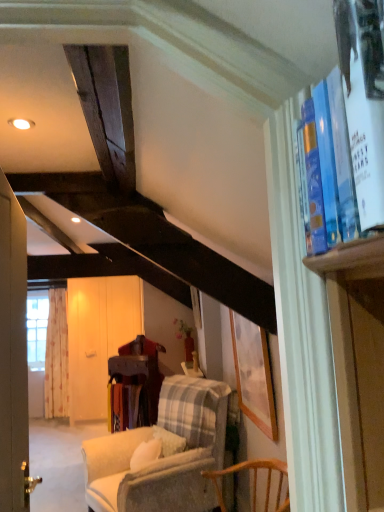
I want to click on plaid fabric chair at center, so click(x=163, y=457).

This screenshot has width=384, height=512. What do you see at coordinates (57, 356) in the screenshot? I see `light beige fabric curtain at left` at bounding box center [57, 356].

Where is `blue hardcover book at upper right`? blue hardcover book at upper right is located at coordinates (363, 101).

You are a GUI agent. You are given a task and a screenshot of the screen. Output one action in this format:
    pyautogui.click(x=<x>, y=<y>)
    Task: Click on the chair on the left of blue hardcover book at upper right
    This screenshot has height=512, width=384.
    Given the screenshot: What is the action you would take?
    pyautogui.click(x=163, y=457)

Based on the photo, which is farther, (132, 504) or (349, 125)?

The point (132, 504) is farther.

What's the angular difference between plaid fabric chair at center and blue hardcover book at upper right's facing directions?

They differ by 25.8 degrees in their facing directions.

Identify the location of screen door behind the blue hardcover book at upper right. The height and width of the screenshot is (512, 384). (98, 337).

From a real-world perspective, which object rests below the other?

white wood screen door at center, from a real-world perspective.

In the scene shown: Between white wood screen door at center and blue hardcover book at upper right, which one has smaller width?

With smaller width is blue hardcover book at upper right.

Is white wood screen door at center to the left or to the right of blue hardcover book at upper right in the image?

Clearly, white wood screen door at center is on the left of blue hardcover book at upper right in the image.

Measure the distance between light beige fabric curtain at left and blue hardcover book at upper right.

light beige fabric curtain at left is 5.40 meters from blue hardcover book at upper right.

Are light beige fabric curtain at left and blue hardcover book at upper right far apart?

light beige fabric curtain at left is positioned a significant distance from blue hardcover book at upper right.

From the picture: Would you say light beige fabric curtain at left contains blue hardcover book at upper right?

No, blue hardcover book at upper right is not surrounded by light beige fabric curtain at left.

From the image's perspective, is light beige fabric curtain at left above blue hardcover book at upper right?

No, from the image's perspective, light beige fabric curtain at left is not above blue hardcover book at upper right.

Which object is wider, white wood screen door at center or matte wooden picture frame at center?

Wider between the two is white wood screen door at center.

Between white wood screen door at center and matte wooden picture frame at center, which one appears on the left side from the viewer's perspective?

white wood screen door at center.

From a real-world perspective, which object stands above the other?

From a 3D spatial view, matte wooden picture frame at center is above.

From the image's perspective, is white wood screen door at center on top of matte wooden picture frame at center?

No, from the image's perspective, white wood screen door at center is not on top of matte wooden picture frame at center.

At what (x,y) coordinates should I click in order to perform the action: click on curtain below the matte wooden picture frame at center (from the image's perspective). Please return your answer as a coordinate pair (x, y). Image resolution: width=384 pixels, height=512 pixels. Looking at the image, I should click on (57, 356).

From the image's perspective, relative to matte wooden picture frame at center, is light beige fabric curtain at left above or below?

Clearly, from the image's perspective, light beige fabric curtain at left is below matte wooden picture frame at center.

Measure the distance from light beige fabric curtain at left to matte wooden picture frame at center.

light beige fabric curtain at left is 10.78 feet from matte wooden picture frame at center.

Between light beige fabric curtain at left and matte wooden picture frame at center, which one appears on the right side from the viewer's perspective?

Positioned to the right is matte wooden picture frame at center.

Could you tell me if blue hardcover book at upper right is turned towards matte wooden picture frame at center?

No, blue hardcover book at upper right is not turned towards matte wooden picture frame at center.

From their relative heights in the image, would you say blue hardcover book at upper right is taller or shorter than matte wooden picture frame at center?

Clearly, blue hardcover book at upper right is shorter compared to matte wooden picture frame at center.

Considering the relative sizes of blue hardcover book at upper right and matte wooden picture frame at center in the image provided, is blue hardcover book at upper right thinner than matte wooden picture frame at center?

No, blue hardcover book at upper right is not thinner than matte wooden picture frame at center.

Does blue hardcover book at upper right contain matte wooden picture frame at center?

No, blue hardcover book at upper right does not contain matte wooden picture frame at center.

Who is more distant, white wood screen door at center or light beige fabric curtain at left?

light beige fabric curtain at left is more distant.

Is white wood screen door at center facing towards light beige fabric curtain at left?

No.

Is white wood screen door at center bigger than light beige fabric curtain at left?

Indeed, white wood screen door at center has a larger size compared to light beige fabric curtain at left.

Are white wood screen door at center and light beige fabric curtain at left far apart?

Actually, white wood screen door at center and light beige fabric curtain at left are a little close together.

Locate an element on the screen. The width and height of the screenshot is (384, 512). chair below the blue hardcover book at upper right (from the image's perspective) is located at coordinates (163, 457).

This screenshot has height=512, width=384. I want to click on book above the white wood screen door at center (from a real-world perspective), so click(363, 101).

When comparing their distances from white wood screen door at center, does blue hardcover book at upper right or light beige fabric curtain at left seem closer?

light beige fabric curtain at left is positioned closer to the anchor white wood screen door at center.

From the image, which object appears to be farther from blue hardcover book at upper right, light beige fabric curtain at left or matte wooden picture frame at center?

light beige fabric curtain at left is positioned further to the anchor blue hardcover book at upper right.

From the image, which object appears to be farther from light beige fabric curtain at left, white wood screen door at center or plaid fabric chair at center?

plaid fabric chair at center is positioned further to the anchor light beige fabric curtain at left.

From the image, which object appears to be nearer to matte wooden picture frame at center, plaid fabric chair at center or blue hardcover book at upper right?

plaid fabric chair at center is closer to matte wooden picture frame at center.

When comparing their distances from plaid fabric chair at center, does white wood screen door at center or light beige fabric curtain at left seem further?

light beige fabric curtain at left is positioned further to the anchor plaid fabric chair at center.

In the scene shown: Considering their positions, is blue hardcover book at upper right positioned closer to light beige fabric curtain at left than white wood screen door at center?

white wood screen door at center is positioned closer to the anchor light beige fabric curtain at left.

Based on the photo, considering their positions, is blue hardcover book at upper right positioned further to plaid fabric chair at center than matte wooden picture frame at center?

The object further to plaid fabric chair at center is blue hardcover book at upper right.

Which object lies nearer to the anchor point light beige fabric curtain at left, plaid fabric chair at center or matte wooden picture frame at center?

Among the two, plaid fabric chair at center is located nearer to light beige fabric curtain at left.

The width and height of the screenshot is (384, 512). What are the coordinates of `picture frame between blue hardcover book at upper right and plaid fabric chair at center along the z-axis` in the screenshot? It's located at (253, 374).

This screenshot has height=512, width=384. What are the coordinates of `screen door located between matte wooden picture frame at center and light beige fabric curtain at left in the depth direction` in the screenshot? It's located at (98, 337).

At what (x,y) coordinates should I click in order to perform the action: click on screen door between plaid fabric chair at center and light beige fabric curtain at left from front to back. Please return your answer as a coordinate pair (x, y). Looking at the image, I should click on (98, 337).

Identify the location of chair between blue hardcover book at upper right and white wood screen door at center in the front-back direction. (163, 457).